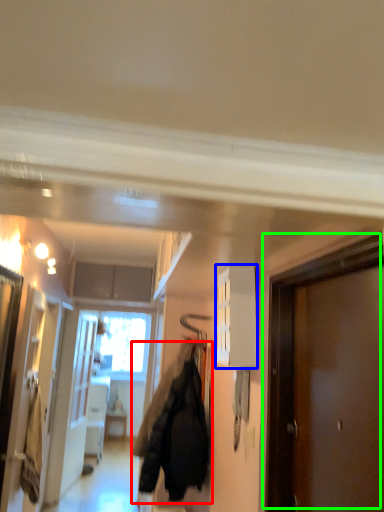
Question: Which object is the closest to the jacket (highlighted by a red box)? Choose among these: cabinetry (highlighted by a blue box) or door (highlighted by a green box).

Choices:
 (A) cabinetry
 (B) door

Answer: (A)